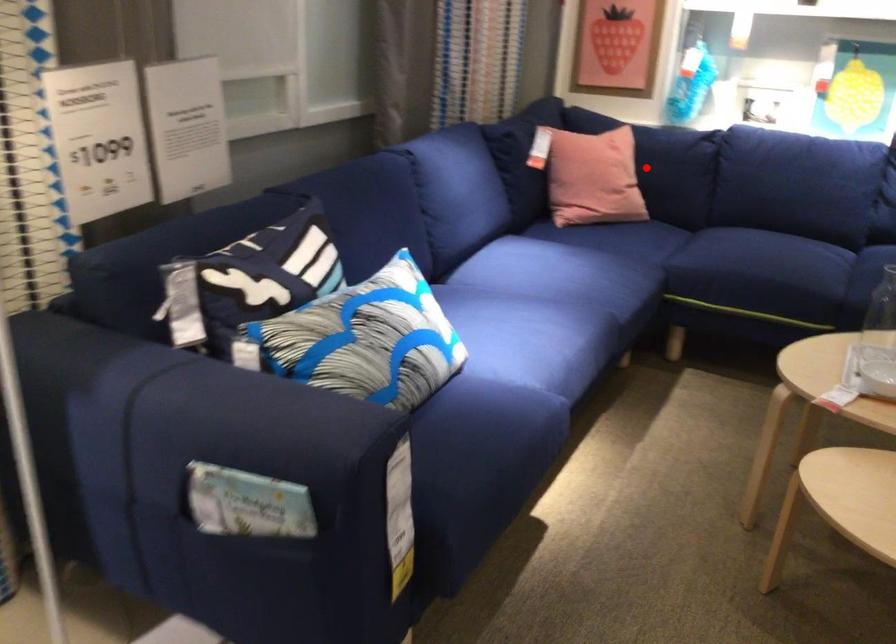
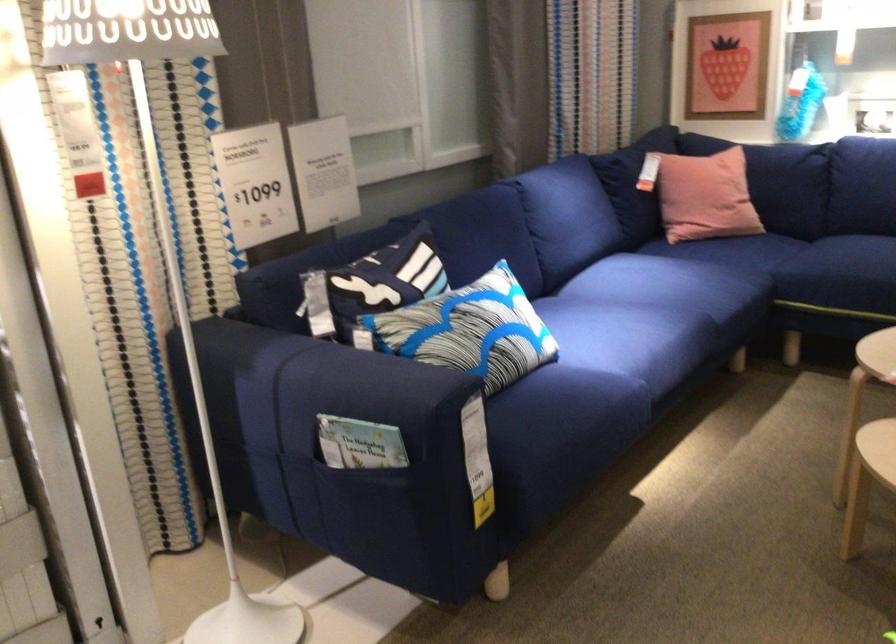
Find the pixel in the second image that matches the highlighted location in the first image.

(759, 176)